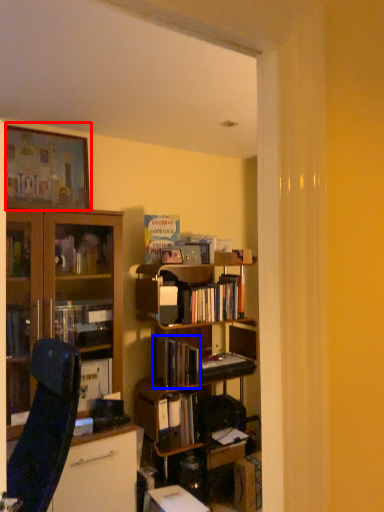
Question: Among these objects, which one is farthest to the camera, picture frame (highlighted by a red box) or book (highlighted by a blue box)?

Choices:
 (A) picture frame
 (B) book

Answer: (B)